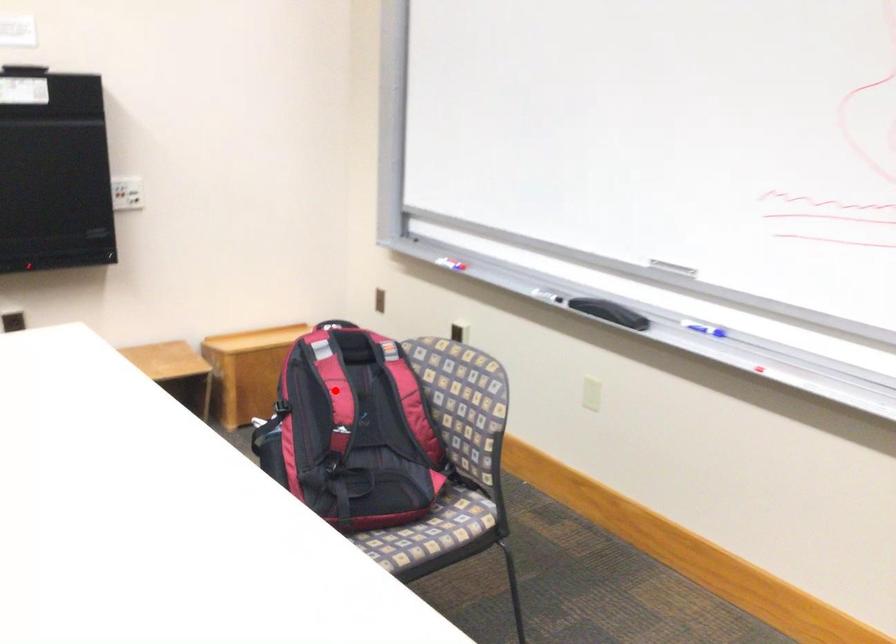
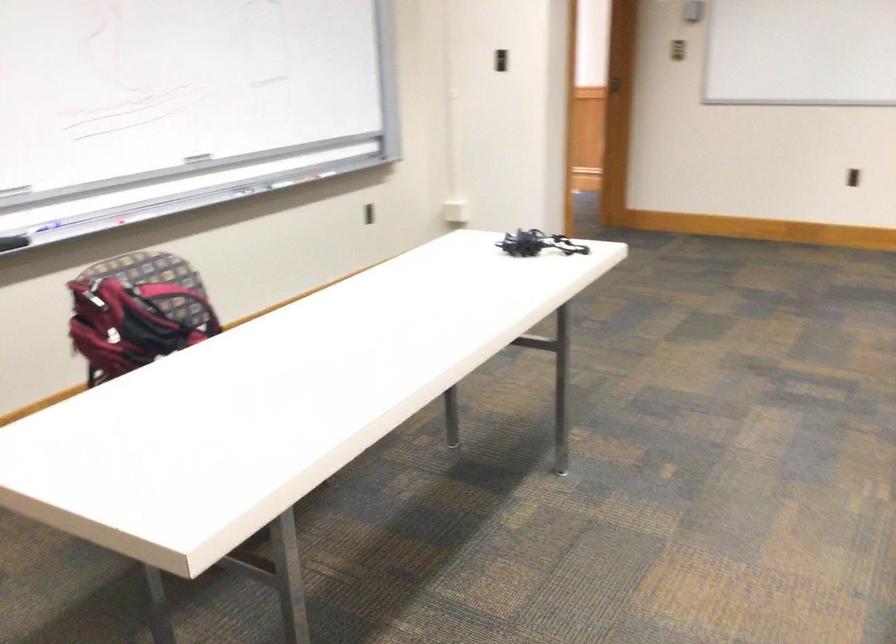
Question: I am providing you with two images of the same scene from different viewpoints. A red point is marked on the first image. Can you still see the location of the red point in image 2?

Choices:
 (A) Yes
 (B) No

Answer: (B)